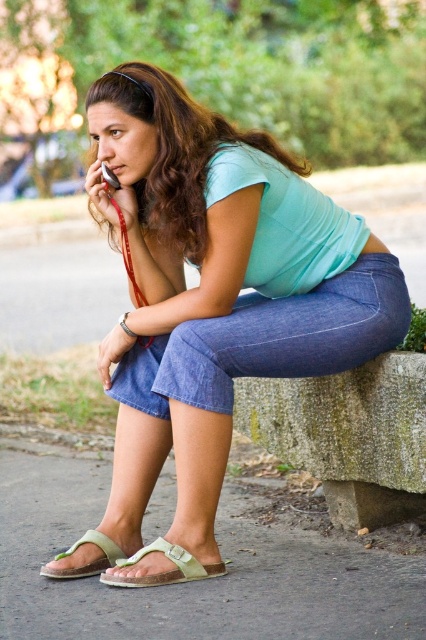
You are a fashion designer observing the woman in the scene. You need to determine which item of clothing is taller between the denim at left and the green cork sandal at lower center. Which one is taller?

The denim at left is taller than the green cork sandal at lower center according to the description.

You are a shoe designer observing the woman sitting on the bench. You notice two green sandals near her feet. Which one is bigger between the green cork sandal at lower center and the green suede sandal at lower left?

The green cork sandal at lower center is larger in size than the green suede sandal at lower left.

You are a photographer trying to capture the woman in the image. You want to ensure that both the denim at left and the green cork sandal at lower center are visible in your shot. Based on their positions, which object should you focus on first to frame the shot properly?

The denim at left is located above the green cork sandal at lower center, so you should focus on the denim at left first to ensure both are in frame.